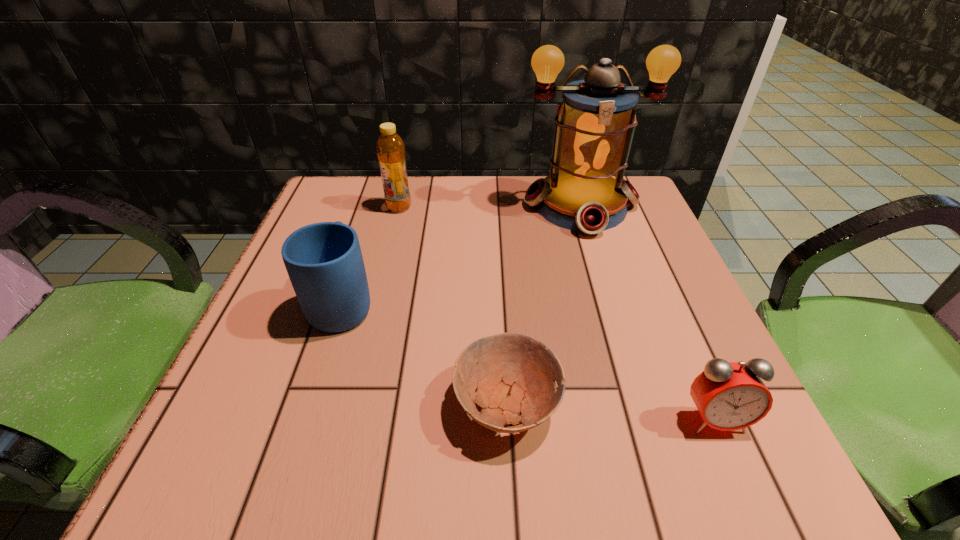
The height and width of the screenshot is (540, 960). I want to click on object positioned at the near right corner, so click(729, 396).

Image resolution: width=960 pixels, height=540 pixels. What are the coordinates of `free space at the far edge of the desktop` in the screenshot? It's located at (461, 224).

At what (x,y) coordinates should I click in order to perform the action: click on blank area at the near edge. Please return your answer as a coordinate pair (x, y). Looking at the image, I should click on (579, 451).

Find the location of a particular element. This screenshot has width=960, height=540. blank space at the right edge of the desktop is located at coordinates (675, 286).

You are a GUI agent. You are given a task and a screenshot of the screen. Output one action in this format:
    pyautogui.click(x=<x>, y=<y>)
    Task: Click on the free space at the far left corner
    This screenshot has width=960, height=540.
    Given the screenshot: What is the action you would take?
    pyautogui.click(x=353, y=201)

Where is `vacant space at the near left corner of the desktop`? The image size is (960, 540). vacant space at the near left corner of the desktop is located at coordinates (295, 429).

The image size is (960, 540). I want to click on vacant space at the near right corner of the desktop, so click(762, 464).

What are the coordinates of `free space between the mug and the tallest object` in the screenshot? It's located at (462, 254).

Identify the location of free space between the lantern and the third nearest object. (462, 254).

In order to click on free space between the alarm clock and the tallest object in this screenshot , I will do `click(647, 312)`.